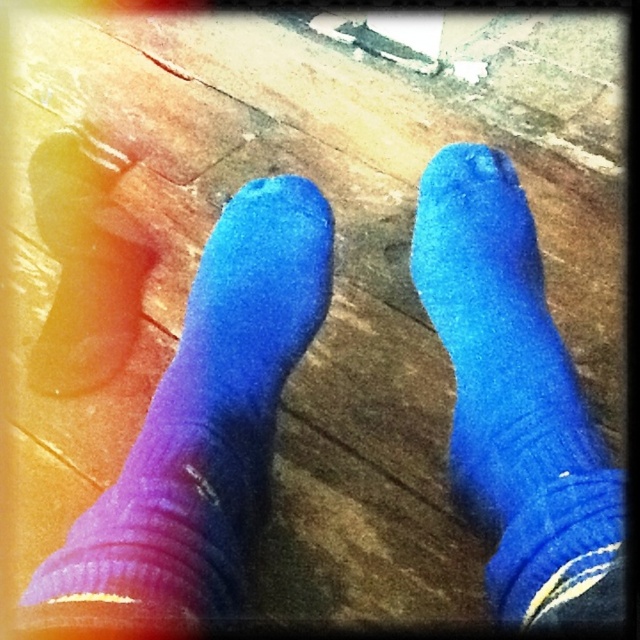
You are standing on a wooden deck and see a point marked at coordinates (202, 428). What color is the sock located at that point?

The point at coordinates (202, 428) marks a purple matte sock at lower left.

You are a photographer trying to capture the perfect shot of the purple matte socks at lower left and the purple matte sock at lower left. The camera requires at least 3 inches between the two objects to focus properly. Based on the scene, will the camera be able to focus on both?

The purple matte socks at lower left is 2.13 inches from purple matte sock at lower left, which is less than the required 3 inches. Therefore, the camera will not be able to focus on both.

You are standing on a wooden deck and notice two socks on the ground. The purple matte socks at lower left and the blue fuzzy sock at center. Which sock is closer to the edge of the deck?

The purple matte socks at lower left is closer to the edge of the deck because it is positioned below the blue fuzzy sock at center, indicating it is nearer to the deck edge.